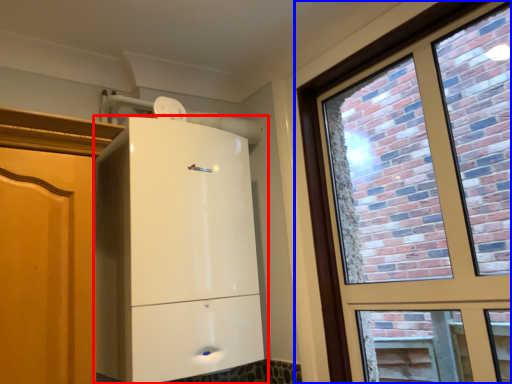
Question: Which object appears closest to the camera in this image, cupboard (highlighted by a red box) or window (highlighted by a blue box)?

Choices:
 (A) cupboard
 (B) window

Answer: (B)